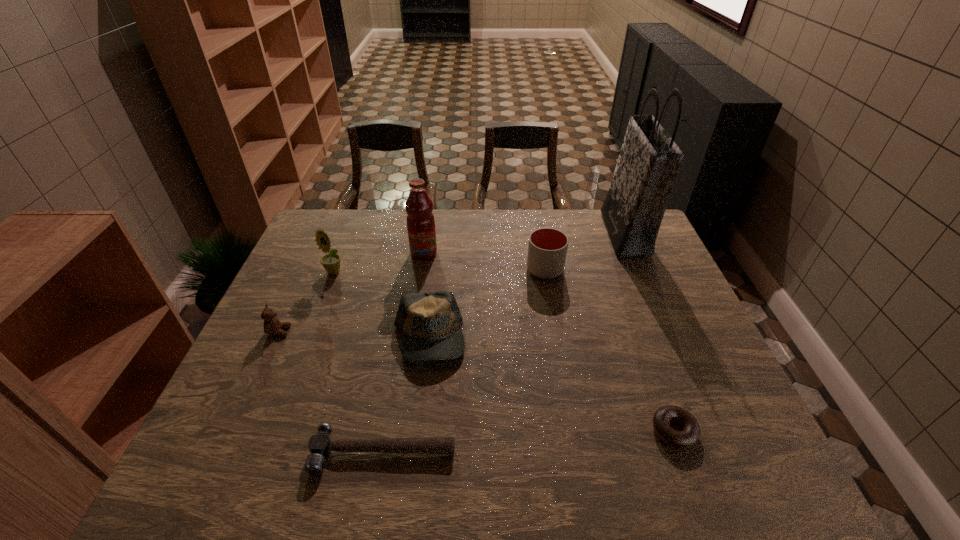
Identify the location of vacant area that lies between the cup and the baseball cap. (487, 304).

You are a GUI agent. You are given a task and a screenshot of the screen. Output one action in this format:
    pyautogui.click(x=<x>, y=<y>)
    Task: Click on the vacant area between the teddy bear and the tallest object
    This screenshot has width=960, height=540.
    Given the screenshot: What is the action you would take?
    pyautogui.click(x=452, y=282)

Find the location of a particular element. The height and width of the screenshot is (540, 960). free area in between the doughnut and the leftmost object is located at coordinates (476, 381).

I want to click on unoccupied position between the leftmost object and the third tallest object, so click(x=306, y=302).

This screenshot has height=540, width=960. I want to click on vacant space that's between the doughnut and the sunflower, so click(504, 352).

Where is `object that ranks as the seventh closest to the tallest object`? The height and width of the screenshot is (540, 960). object that ranks as the seventh closest to the tallest object is located at coordinates (272, 325).

Where is `object that is the third closest to the hammer`? This screenshot has width=960, height=540. object that is the third closest to the hammer is located at coordinates (691, 433).